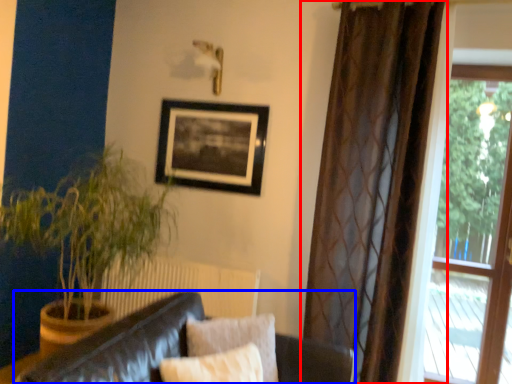
Question: Which object is further to the camera taking this photo, curtain (highlighted by a red box) or studio couch (highlighted by a blue box)?

Choices:
 (A) curtain
 (B) studio couch

Answer: (A)